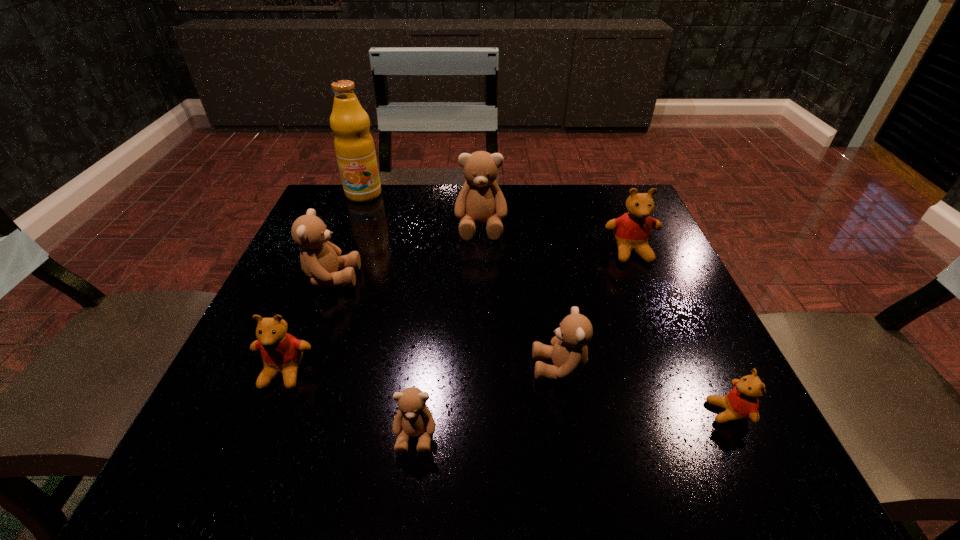
This screenshot has width=960, height=540. Identify the location of brown teddy bear that is the closest to the third nearest brown teddy bear. (480, 200).

Select which brown teddy bear appears as the closest to the third teddy bear from left to right. Please provide its 2D coordinates. Your answer should be formatted as a tuple, i.e. [(x, y)], where the tuple contains the x and y coordinates of a point satisfying the conditions above.

[(569, 353)]

Identify which red teddy bear is the second nearest to the smallest red teddy bear. Please provide its 2D coordinates. Your answer should be formatted as a tuple, i.e. [(x, y)], where the tuple contains the x and y coordinates of a point satisfying the conditions above.

[(281, 352)]

Identify which red teddy bear is the nearest to the leftmost brown teddy bear. Please provide its 2D coordinates. Your answer should be formatted as a tuple, i.e. [(x, y)], where the tuple contains the x and y coordinates of a point satisfying the conditions above.

[(281, 352)]